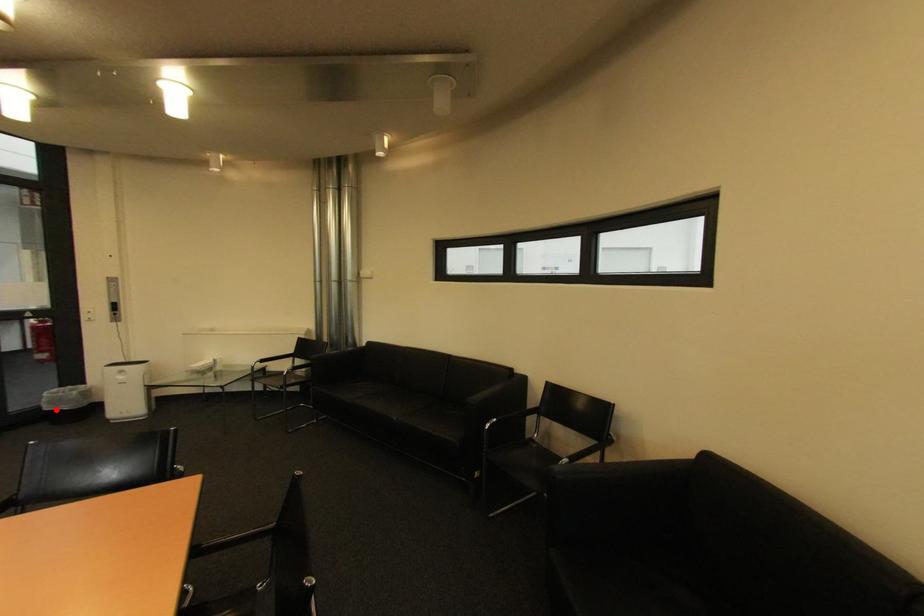
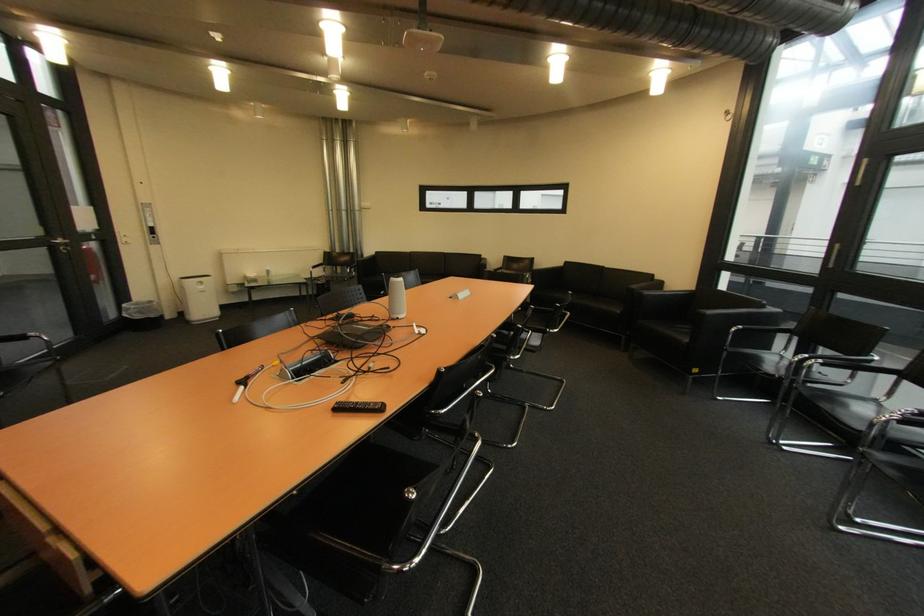
Question: I am providing you with two images of the same scene from different viewpoints. A red point is shown in image1. For the corresponding object point in image2, is it positioned nearer or farther from the camera?

Choices:
 (A) Nearer
 (B) Farther

Answer: (A)